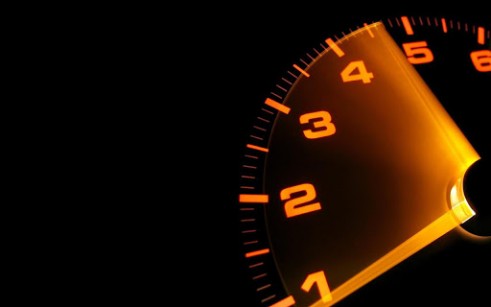
Identify the location of the bottom left corner empty space. (3, 304).